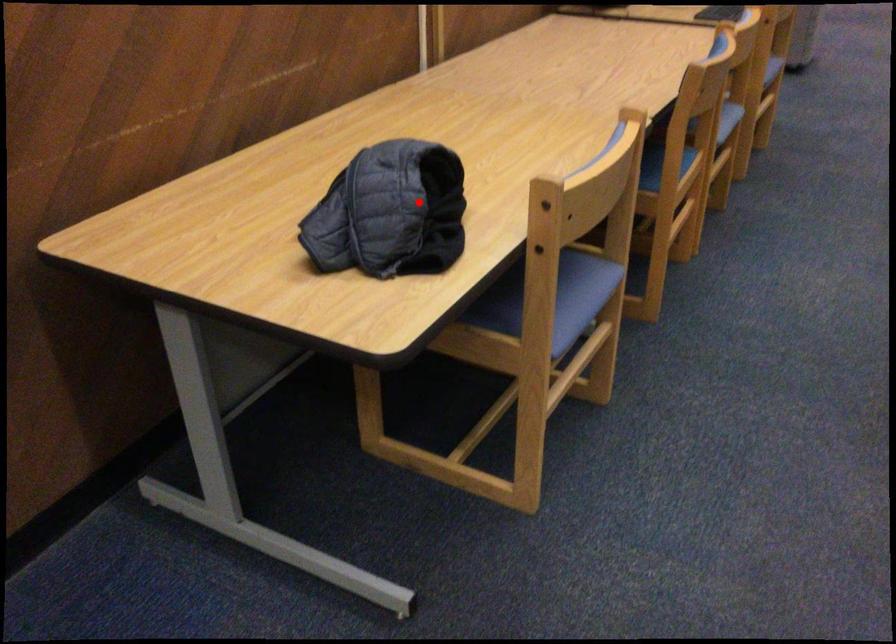
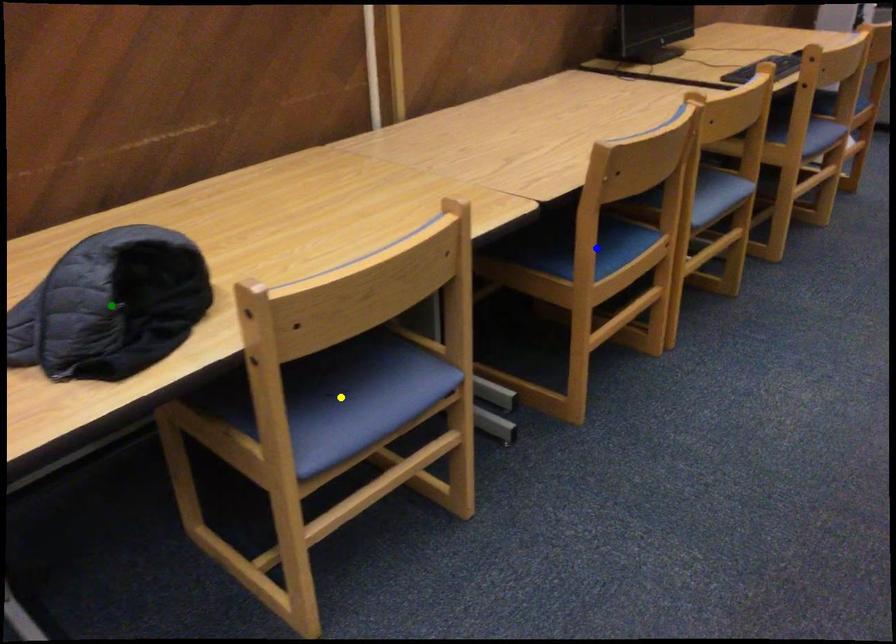
Question: I am providing you with two images of the same scene from different viewpoints. A red point is marked on the first image. You are given multiple points on the second image. Which mark in image 2 goes with the point in image 1?

Choices:
 (A) yellow point
 (B) green point
 (C) blue point

Answer: (B)